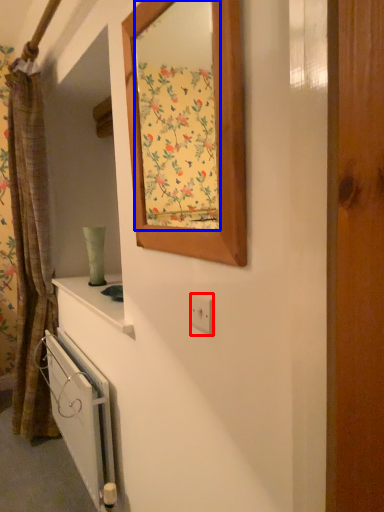
Question: Among these objects, which one is farthest to the camera, electric outlet (highlighted by a red box) or mirror (highlighted by a blue box)?

Choices:
 (A) electric outlet
 (B) mirror

Answer: (A)